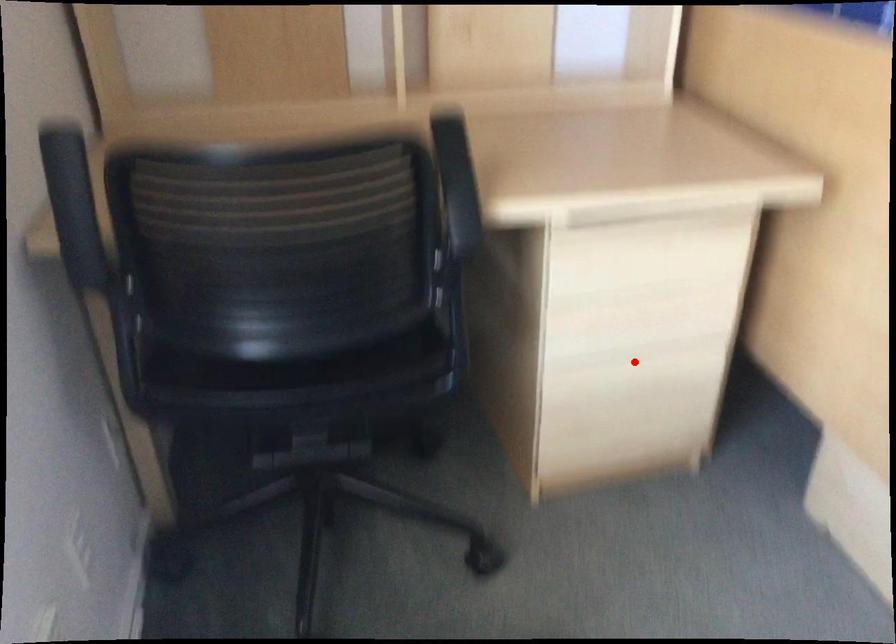
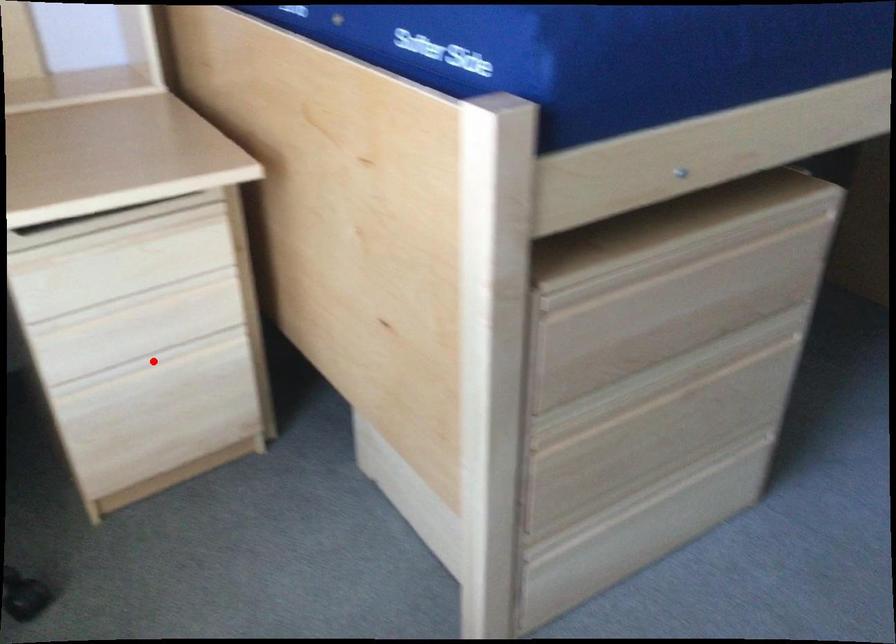
I am providing you with two images of the same scene from different viewpoints. A red point is marked on the first image and another point is marked on the second image. Do the highlighted points in image1 and image2 indicate the same real-world spot?

Yes